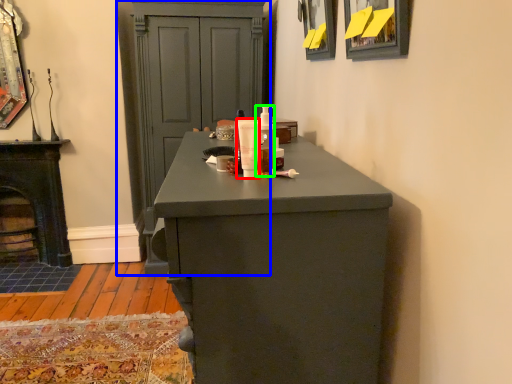
Question: Which object is the farthest from mouthwash (highlighted by a red box)? Choose among these: cupboard (highlighted by a blue box) or mouthwash (highlighted by a green box).

Choices:
 (A) cupboard
 (B) mouthwash

Answer: (A)